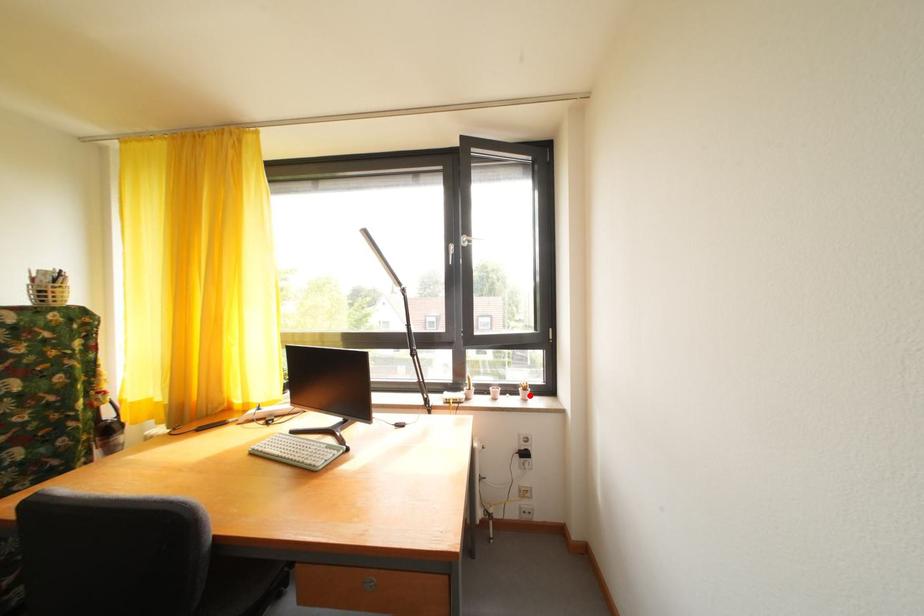
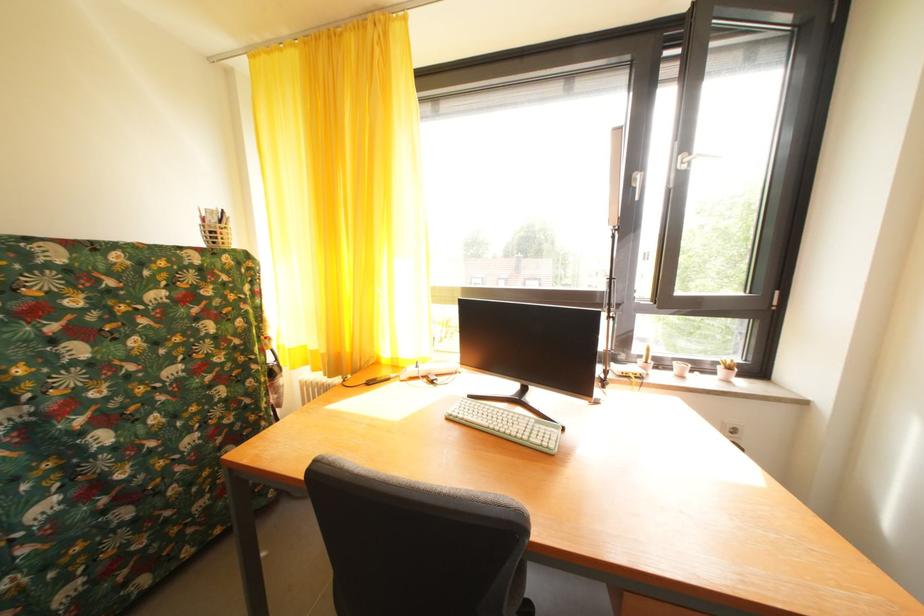
The point at the highlighted location is marked in the first image. Where is the corresponding point in the second image?

(728, 374)